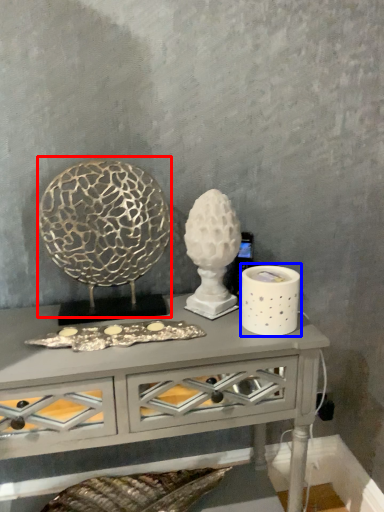
Question: Which object is closer to the camera taking this photo, sculpture (highlighted by a red box) or candle holder (highlighted by a blue box)?

Choices:
 (A) sculpture
 (B) candle holder

Answer: (A)